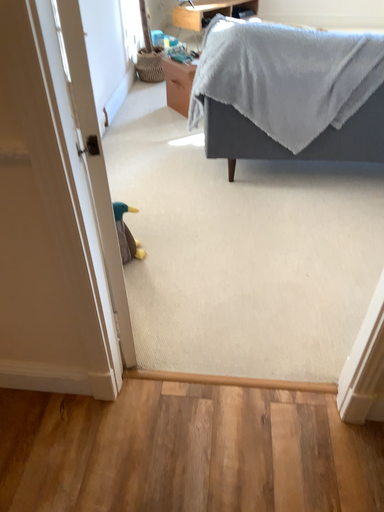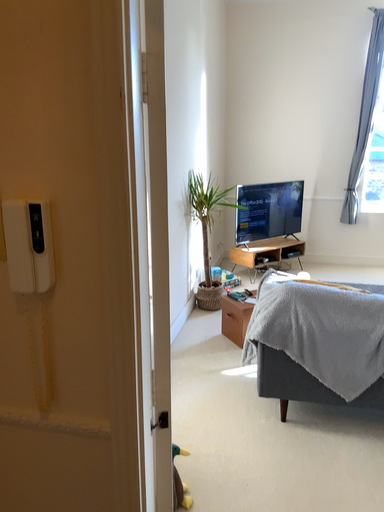
Question: Which way did the camera rotate in the video?

Choices:
 (A) rotated upward
 (B) rotated downward

Answer: (A)